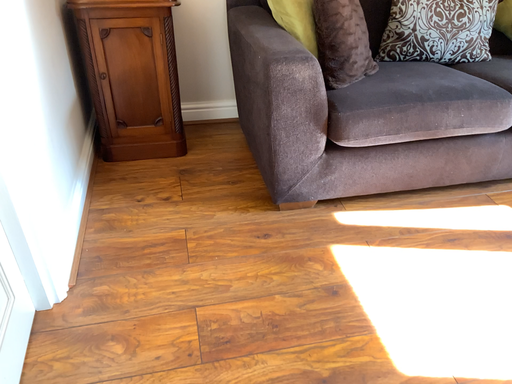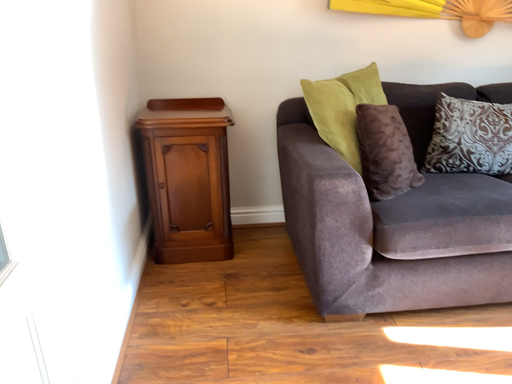
Question: Which way did the camera rotate in the video?

Choices:
 (A) rotated right
 (B) rotated left

Answer: (B)